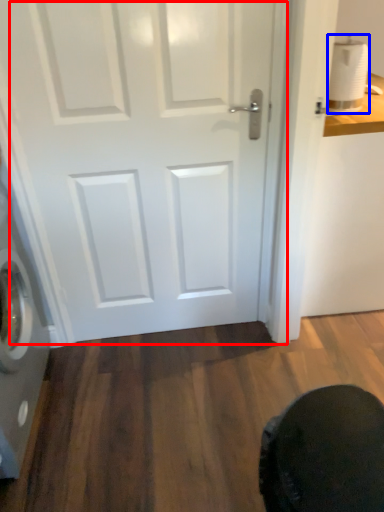
Question: Which point is closer to the camera, door (highlighted by a red box) or toilet paper (highlighted by a blue box)?

Choices:
 (A) door
 (B) toilet paper

Answer: (A)